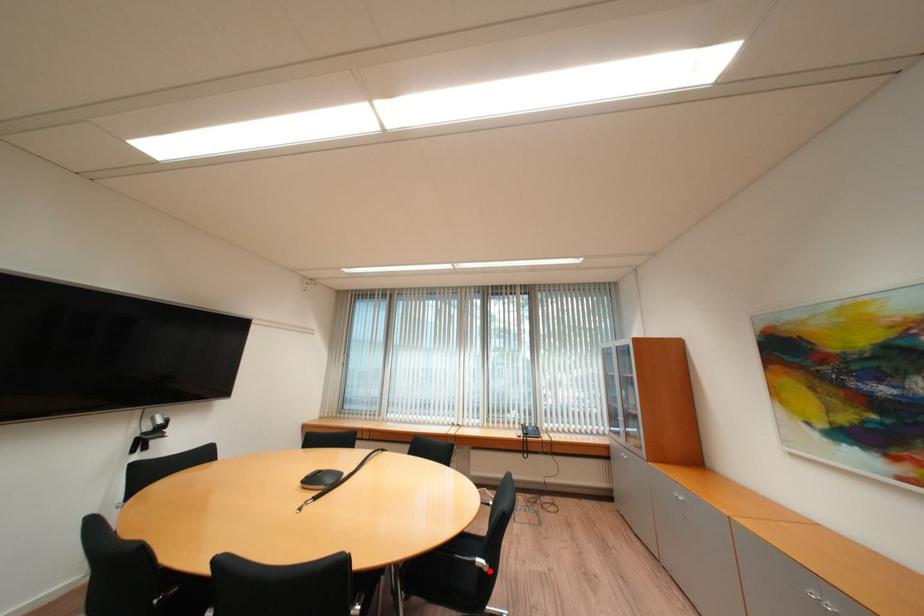
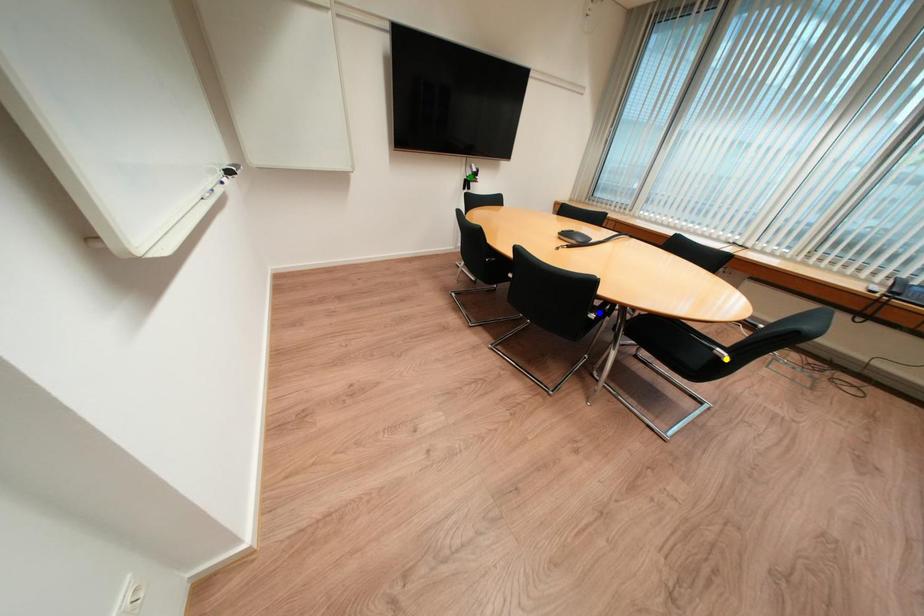
Question: I am providing you with two images of the same scene from different viewpoints. A red point is marked on the first image. You are given multiple points on the second image. In image 2, which mark is for the same physical point as the one in image 1?

Choices:
 (A) blue point
 (B) green point
 (C) yellow point

Answer: (C)